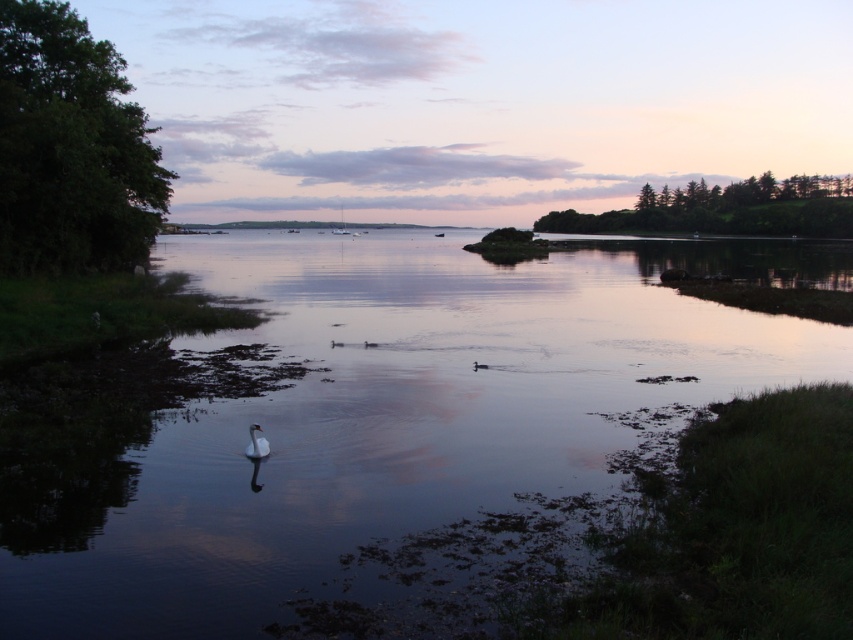
Question: Estimate the real-world distances between objects in this image. Which object is closer to the clear water at center?

Choices:
 (A) green leafy trees at upper right
 (B) white glossy swan at lower center

Answer: (B)

Question: Based on their relative distances, which object is farther from the white glossy swan at lower center?

Choices:
 (A) clear water at center
 (B) green leafy trees at upper right
 (C) green leafy tree at left

Answer: (B)

Question: Is clear water at center positioned behind white glossy swan at lower center?

Choices:
 (A) no
 (B) yes

Answer: (A)

Question: Does green leafy tree at left appear on the left side of white glossy swan at lower center?

Choices:
 (A) no
 (B) yes

Answer: (B)

Question: Does clear water at center have a lesser width compared to green leafy tree at left?

Choices:
 (A) no
 (B) yes

Answer: (A)

Question: Which object is positioned closest to the white glossy swan at lower center?

Choices:
 (A) green leafy trees at upper right
 (B) green leafy tree at left

Answer: (B)